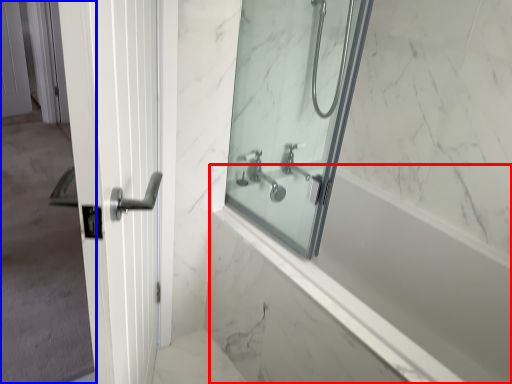
Question: Which object is closer to the camera taking this photo, bath (highlighted by a red box) or screen door (highlighted by a blue box)?

Choices:
 (A) bath
 (B) screen door

Answer: (B)